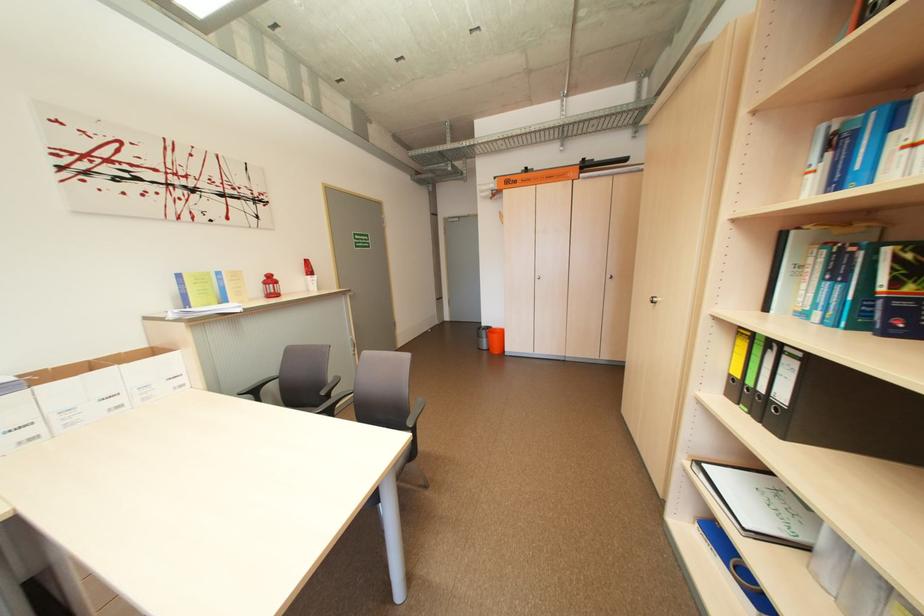
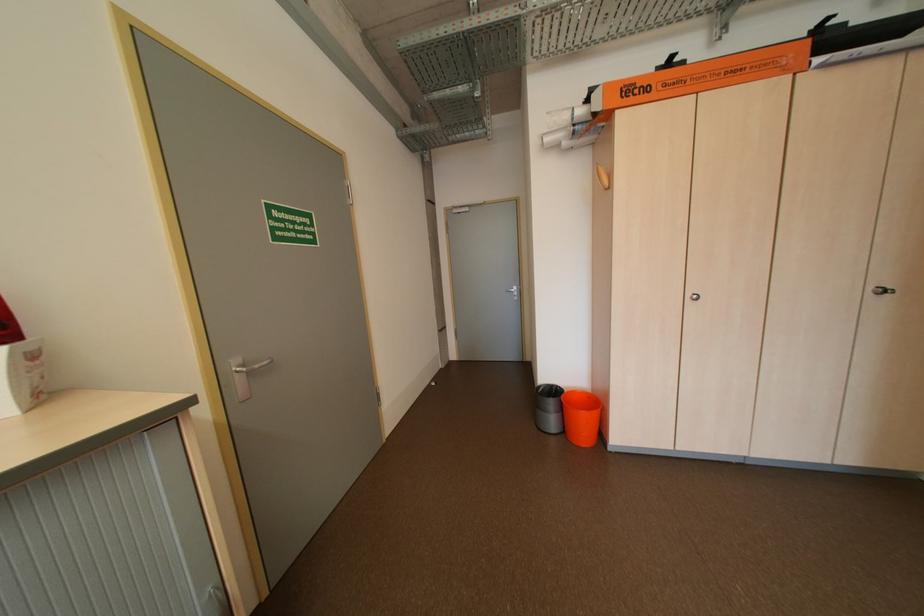
The point at (324, 284) is marked in the first image. Where is the corresponding point in the second image?

(6, 383)